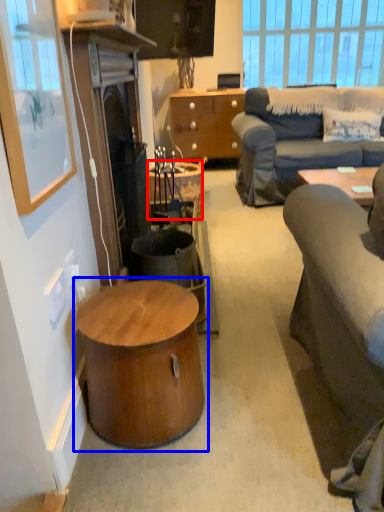
Question: Which object is further to the camera taking this photo, desk (highlighted by a red box) or coffee table (highlighted by a blue box)?

Choices:
 (A) desk
 (B) coffee table

Answer: (A)